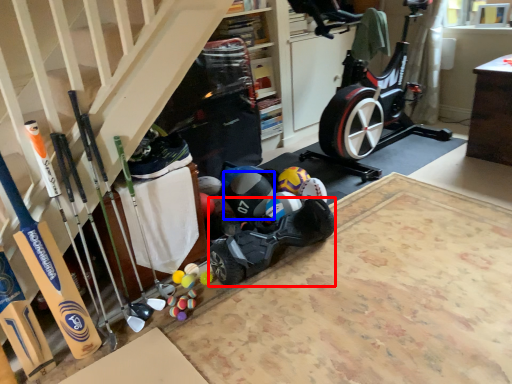
Question: Which object appears farthest to the camera in this image, car (highlighted by a red box) or sports equipment (highlighted by a blue box)?

Choices:
 (A) car
 (B) sports equipment

Answer: (B)